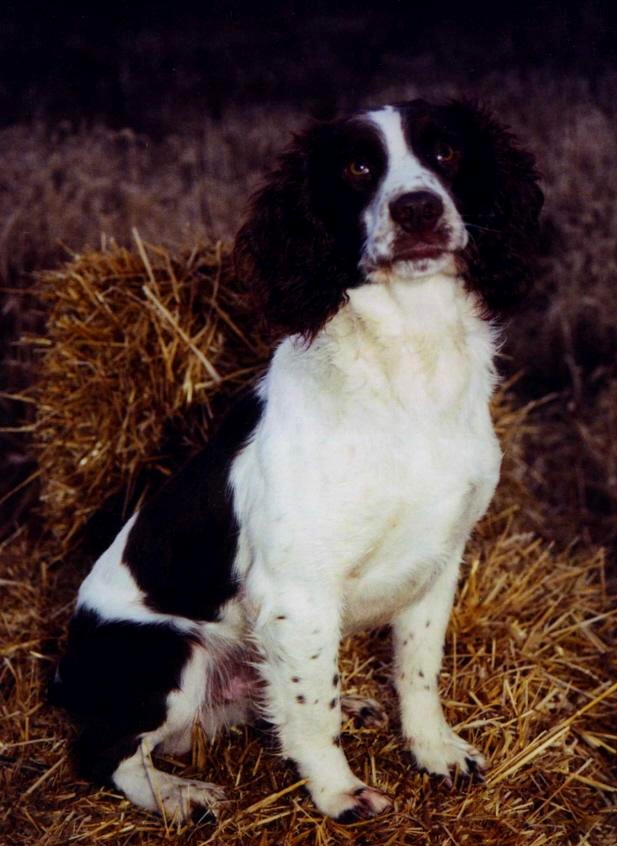
Where is `left front leg`? left front leg is located at coordinates (433, 639).